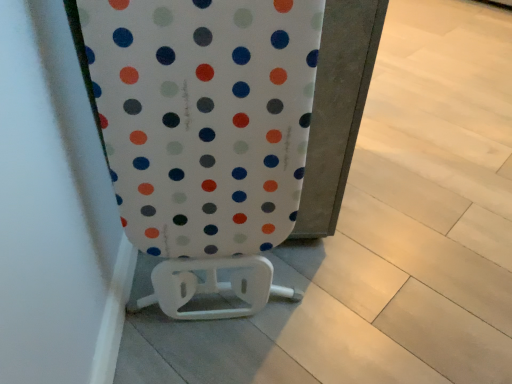
Where is `vacant area in front of white plastic toilet at center`? vacant area in front of white plastic toilet at center is located at coordinates (223, 356).